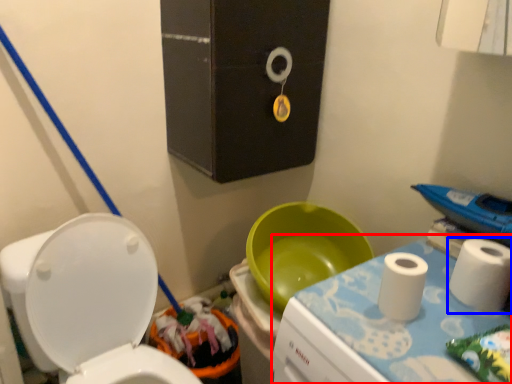
Question: Which object is closer to the camera taking this photo, changing table (highlighted by a red box) or toiletry (highlighted by a blue box)?

Choices:
 (A) changing table
 (B) toiletry

Answer: (A)